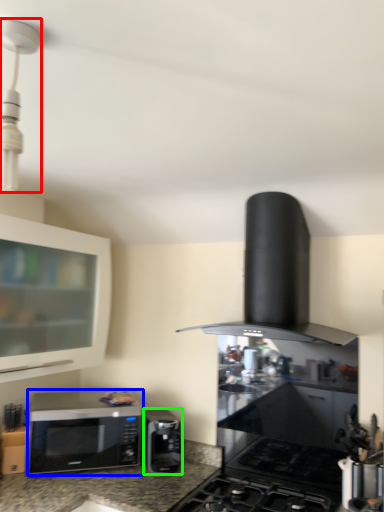
Question: Which object is positioned farthest from light fixture (highlighted by a red box)? Select from microwave oven (highlighted by a blue box) and microwave oven (highlighted by a green box).

Choices:
 (A) microwave oven
 (B) microwave oven

Answer: (B)